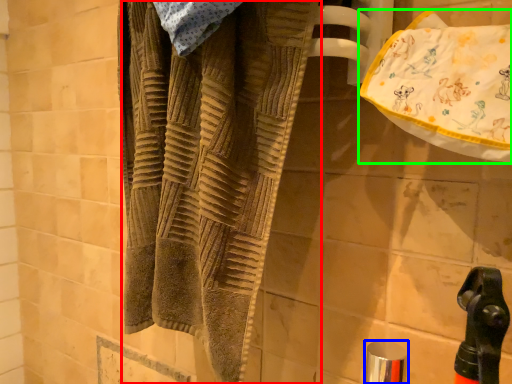
Question: Based on their relative distances, which object is farther from towel (highlighted by a red box)? Choose from faucet (highlighted by a blue box) and beach towel (highlighted by a green box).

Choices:
 (A) faucet
 (B) beach towel

Answer: (A)